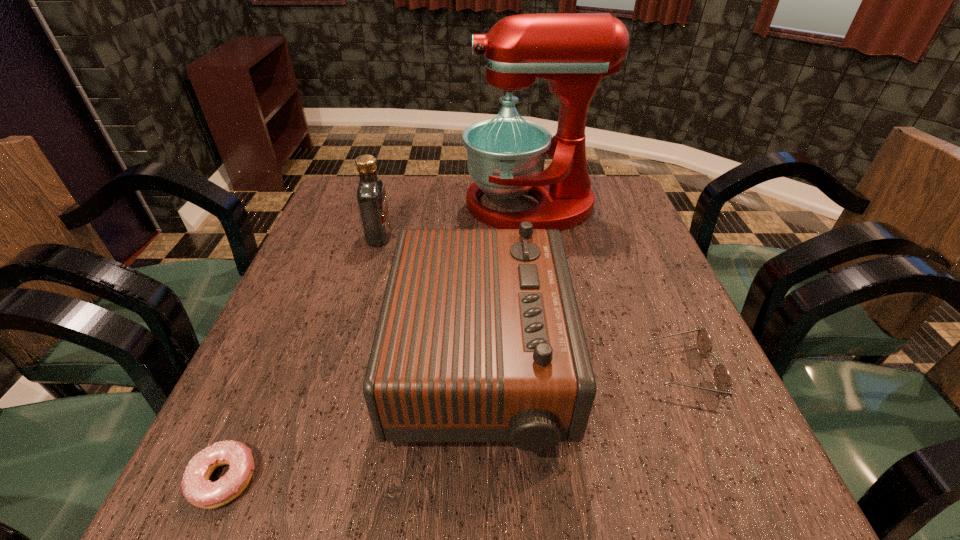
This screenshot has height=540, width=960. Identify the location of object that is the closest one to the leftmost object. (479, 338).